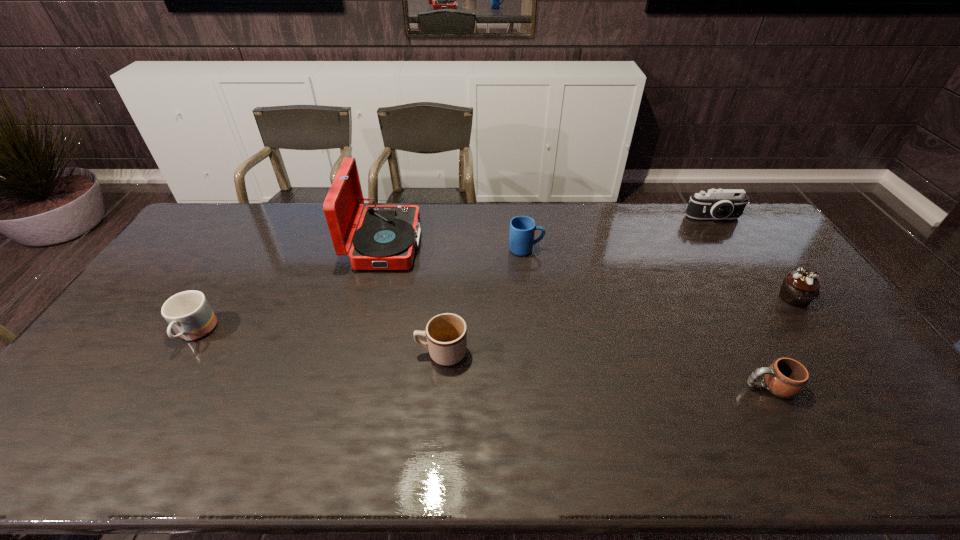
Point out which object is positioned as the second nearest to the camera. Please provide its 2D coordinates. Your answer should be formatted as a tuple, i.e. [(x, y)], where the tuple contains the x and y coordinates of a point satisfying the conditions above.

[(522, 228)]

Where is `object identified as the sixth closest to the sixth object from right to left`? The height and width of the screenshot is (540, 960). object identified as the sixth closest to the sixth object from right to left is located at coordinates (799, 288).

Identify the location of mug that is the third closest to the nearest object. Image resolution: width=960 pixels, height=540 pixels. (188, 313).

Where is `mug that is the closest to the third object from left to right`? The height and width of the screenshot is (540, 960). mug that is the closest to the third object from left to right is located at coordinates (522, 228).

This screenshot has width=960, height=540. I want to click on free region that satisfies the following two spatial constraints: 1. on the front-facing side of the tallest object; 2. on the side of the third object from left to right with the handle, so click(358, 353).

The height and width of the screenshot is (540, 960). What are the coordinates of `vacant region that satisfies the following two spatial constraints: 1. on the side of the fourth object from right to left with the handle; 2. on the side with the handle of the leftmost mug` in the screenshot? It's located at (536, 334).

Locate an element on the screen. This screenshot has height=540, width=960. free spot that satisfies the following two spatial constraints: 1. on the side of the third mug from right to left with the handle; 2. on the back side of the fourth farthest object is located at coordinates (446, 298).

You are a GUI agent. You are given a task and a screenshot of the screen. Output one action in this format:
    pyautogui.click(x=<x>, y=<y>)
    Task: Click on the free space that satisfies the following two spatial constraints: 1. on the front lens of the camera; 2. on the right side of the cupcake
    
    Given the screenshot: What is the action you would take?
    pyautogui.click(x=766, y=298)

Identify the location of free space in the image that satisfies the following two spatial constraints: 1. on the side of the second mug from right to left with the handle; 2. on the side with the handle of the leftmost mug. The image size is (960, 540). (536, 334).

Locate an element on the screen. free space that satisfies the following two spatial constraints: 1. on the front lens of the camera; 2. on the front-facing side of the sixth object from right to left is located at coordinates (731, 244).